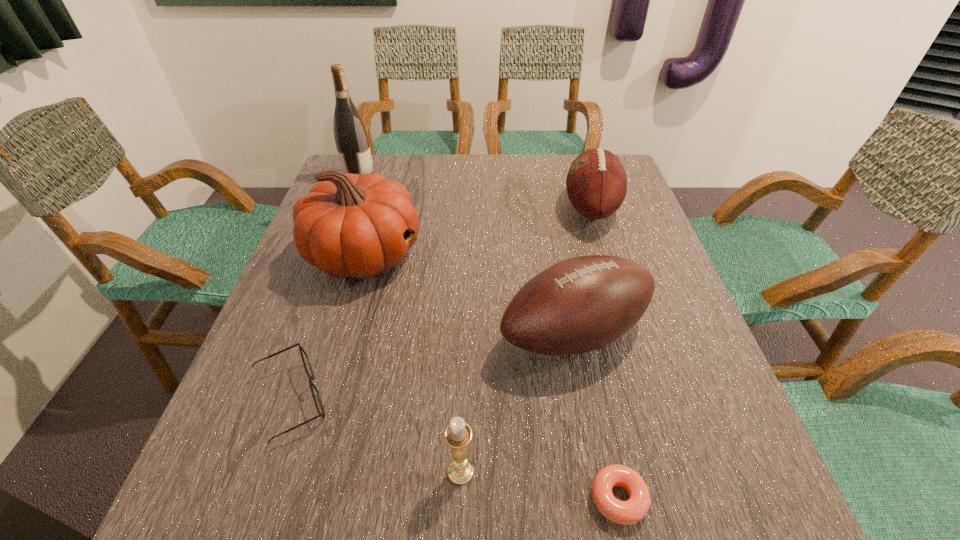
The height and width of the screenshot is (540, 960). What are the coordinates of `free space located 0.120m on the back of the farther football (American)` in the screenshot? It's located at (577, 161).

You are a GUI agent. You are given a task and a screenshot of the screen. Output one action in this format:
    pyautogui.click(x=<x>, y=<y>)
    Task: Click on the vacant space located on the left of the candle holder
    
    Given the screenshot: What is the action you would take?
    pyautogui.click(x=396, y=471)

Where is `vacant region located with the lenses facing outward on the second shortest object`? This screenshot has width=960, height=540. vacant region located with the lenses facing outward on the second shortest object is located at coordinates (360, 400).

At what (x,y) coordinates should I click in order to perform the action: click on free location located on the back of the doughnut. Please return your answer as a coordinate pair (x, y). This screenshot has width=960, height=540. Looking at the image, I should click on (574, 291).

Locate an element on the screen. wine bottle at the far edge is located at coordinates (351, 138).

What are the coordinates of `football (American) at the far edge` in the screenshot? It's located at (596, 183).

The height and width of the screenshot is (540, 960). Find the location of `candle holder at the near edge`. candle holder at the near edge is located at coordinates (458, 434).

Find the location of a particular element. The width and height of the screenshot is (960, 540). doughnut that is at the near edge is located at coordinates (628, 512).

Locate an element on the screen. This screenshot has height=540, width=960. wine bottle situated at the left edge is located at coordinates (351, 138).

Identify the location of pumpkin that is at the left edge. (350, 226).